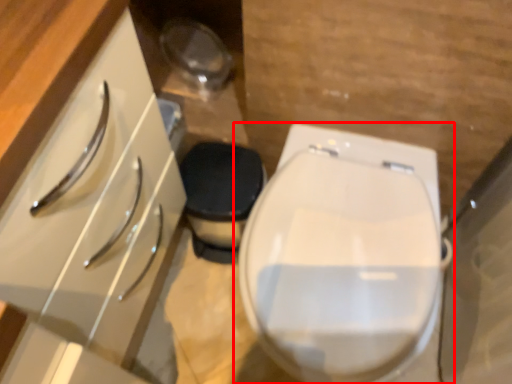
Question: From the image, what is the correct spatial relationship of toilet (annotated by the red box) in relation to cabinetry?

Choices:
 (A) right
 (B) left

Answer: (A)